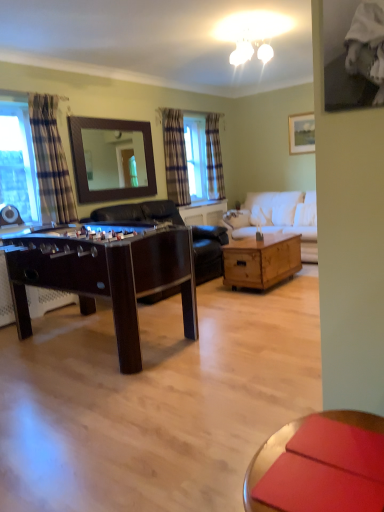
Question: From the image's perspective, is white fabric couch at center positioned above or below plaid fabric curtain at left, which appears as the first curtain when viewed from the front?

Choices:
 (A) above
 (B) below

Answer: (B)

Question: Looking at the image, does white fabric couch at center seem bigger or smaller compared to plaid fabric curtain at left, which appears as the first curtain when viewed from the front?

Choices:
 (A) big
 (B) small

Answer: (A)

Question: Estimate the real-world distances between objects in this image. Which object is farther from the smooth wooden coffee table at lower right?

Choices:
 (A) white fabric couch at center
 (B) plaid fabric curtain at center, the 2th curtain viewed from the left
 (C) clear glass window at left
 (D) wooden framed mirror at upper center
 (E) plaid fabric curtain at left, which is the third curtain from back to front

Answer: (B)

Question: Which of these objects is positioned closest to the matte wooden picture frame at upper right?

Choices:
 (A) white fabric couch at center
 (B) wooden framed mirror at upper center
 (C) dark wood foosball table at center, positioned as the second table in right-to-left order
 (D) wooden coffee table at center, the second table in the left-to-right sequence
 (E) plaid fabric curtain at center, the 2th curtain viewed from the left

Answer: (A)